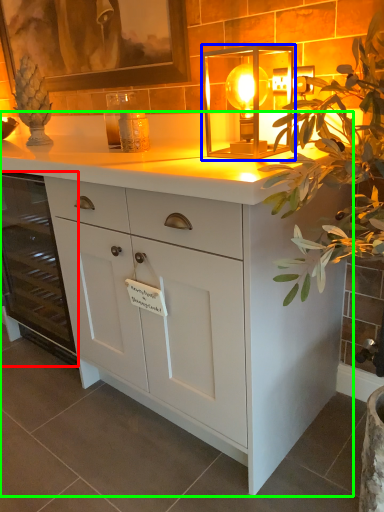
Question: Considering the real-world distances, which object is farthest from cabinetry (highlighted by a red box)? lamp (highlighted by a blue box) or chest of drawers (highlighted by a green box)?

Choices:
 (A) lamp
 (B) chest of drawers

Answer: (A)